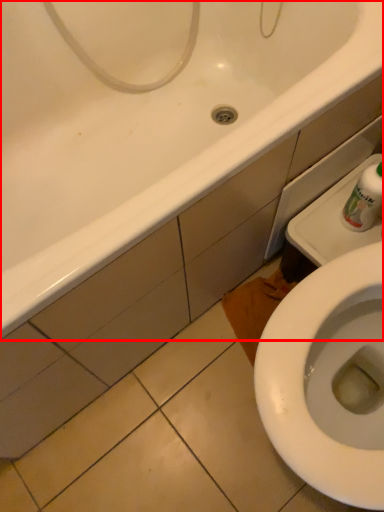
Question: From the image's perspective, where is bathtub (annotated by the red box) located relative to cleaning product?

Choices:
 (A) above
 (B) below

Answer: (A)